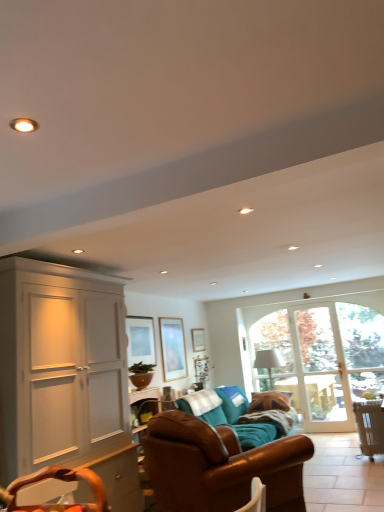
Identify the location of clear glass door at right. (362, 349).

Where is `brown leather swivel chair at lower left`? This screenshot has width=384, height=512. brown leather swivel chair at lower left is located at coordinates pyautogui.click(x=61, y=480).

Where is `white matte cabinet at left`? white matte cabinet at left is located at coordinates (65, 376).

Image resolution: width=384 pixels, height=512 pixels. Describe the element at coordinates (219, 466) in the screenshot. I see `brown leather couch at center, the 2th studio couch in the back-to-front sequence` at that location.

This screenshot has width=384, height=512. Find the location of `brown leather chair at lower right`. brown leather chair at lower right is located at coordinates (370, 426).

Locate an element on the screen. The height and width of the screenshot is (512, 384). clear glass door at right is located at coordinates (362, 349).

Is clear glass door at right closer to camera compared to matte wooden picture frame at center, the second picture frame from the left?

No, it is behind matte wooden picture frame at center, the second picture frame from the left.

Is clear glass door at right to the left of matte wooden picture frame at center, positioned as the second picture frame in right-to-left order, from the viewer's perspective?

No, clear glass door at right is not to the left of matte wooden picture frame at center, positioned as the second picture frame in right-to-left order.

Is clear glass door at right spatially inside matte wooden picture frame at center, which is the second picture frame in front-to-back order, or outside of it?

clear glass door at right cannot be found inside matte wooden picture frame at center, which is the second picture frame in front-to-back order.

Would you say clear glass door at right is a long distance from matte wooden picture frame at center, which is the second picture frame in front-to-back order?

Indeed, clear glass door at right is not near matte wooden picture frame at center, which is the second picture frame in front-to-back order.

The width and height of the screenshot is (384, 512). What are the coordinates of `houseplant that is on the left side of brown leather swivel chair at lower left` in the screenshot? It's located at (141, 374).

Does brown leather swivel chair at lower left touch green matte plant at center?

No, brown leather swivel chair at lower left is not making contact with green matte plant at center.

Is brown leather swivel chair at lower left located outside green matte plant at center?

Absolutely, brown leather swivel chair at lower left is external to green matte plant at center.

From a real-world perspective, between brown leather swivel chair at lower left and green matte plant at center, who is vertically higher?

green matte plant at center is physically above.

In terms of size, does clear glass door at right appear bigger or smaller than matte wooden picture frame at center, the second picture frame from the left?

In the image, clear glass door at right appears to be larger than matte wooden picture frame at center, the second picture frame from the left.

Can you confirm if clear glass door at right is positioned to the right of matte wooden picture frame at center, the second picture frame from the left?

Indeed, clear glass door at right is positioned on the right side of matte wooden picture frame at center, the second picture frame from the left.

Is point (382, 349) more distant than point (165, 377)?

Yes, it is behind point (165, 377).

Is clear glass door at right in contact with matte wooden picture frame at center, which is the second picture frame in front-to-back order?

No, clear glass door at right is not with matte wooden picture frame at center, which is the second picture frame in front-to-back order.

In the image, is brown leather couch at center, the 2th studio couch in the back-to-front sequence, on the left side or the right side of green matte plant at center?

brown leather couch at center, the 2th studio couch in the back-to-front sequence, is positioned on green matte plant at center's right side.

Could you tell me if brown leather couch at center, the first studio couch viewed from the front, is turned towards green matte plant at center?

No, brown leather couch at center, the first studio couch viewed from the front, is not oriented towards green matte plant at center.

Considering the sizes of objects brown leather couch at center, the 2th studio couch in the back-to-front sequence, and green matte plant at center in the image provided, who is smaller, brown leather couch at center, the 2th studio couch in the back-to-front sequence, or green matte plant at center?

With smaller size is green matte plant at center.

From the image's perspective, is matte wooden picture frame at center, the second picture frame from the left, located beneath brown leather couch at center, the 2th studio couch in the back-to-front sequence?

No.

Is matte wooden picture frame at center, which is counted as the second picture frame, starting from the back, taller than brown leather couch at center, the first studio couch viewed from the front?

No, matte wooden picture frame at center, which is counted as the second picture frame, starting from the back, is not taller than brown leather couch at center, the first studio couch viewed from the front.

Is matte wooden picture frame at center, positioned as the second picture frame in right-to-left order, looking in the opposite direction of brown leather couch at center, the first studio couch viewed from the front?

matte wooden picture frame at center, positioned as the second picture frame in right-to-left order, is not turned away from brown leather couch at center, the first studio couch viewed from the front.

From a real-world perspective, which is physically above, matte wooden picture frame at center, positioned as the second picture frame in right-to-left order, or brown leather couch at center, the first studio couch viewed from the front?

In real-world perspective, matte wooden picture frame at center, positioned as the second picture frame in right-to-left order, is above.

How many degrees apart are the facing directions of white matte cabinet at left and brown leather couch at center, the 2th studio couch in the back-to-front sequence?

The angle between the facing direction of white matte cabinet at left and the facing direction of brown leather couch at center, the 2th studio couch in the back-to-front sequence, is 58.4 degrees.

Considering the sizes of objects white matte cabinet at left and brown leather couch at center, the first studio couch viewed from the front, in the image provided, who is taller, white matte cabinet at left or brown leather couch at center, the first studio couch viewed from the front,?

With more height is white matte cabinet at left.

Is white matte cabinet at left wider or thinner than brown leather couch at center, the first studio couch viewed from the front?

Considering their sizes, white matte cabinet at left looks slimmer than brown leather couch at center, the first studio couch viewed from the front.

From the image's perspective, is white matte cabinet at left located above or below brown leather couch at center, the first studio couch viewed from the front?

white matte cabinet at left is above brown leather couch at center, the first studio couch viewed from the front.

From the image's perspective, between brown leather swivel chair at lower left and wooden picture frame at center, the first picture frame positioned from the right, which one is located above?

brown leather swivel chair at lower left.

Which point is more distant from viewer, (94, 476) or (197, 350)?

The point (197, 350) is behind.

Is brown leather swivel chair at lower left smaller than wooden picture frame at center, the first picture frame positioned from the right?

No.

Is brown leather swivel chair at lower left facing away from wooden picture frame at center, positioned as the 1th picture frame in back-to-front order?

No, wooden picture frame at center, positioned as the 1th picture frame in back-to-front order, is not at the back of brown leather swivel chair at lower left.

This screenshot has width=384, height=512. Find the location of `the 1st picture frame positioned above the clear glass door at right (from a real-world perspective)`. the 1st picture frame positioned above the clear glass door at right (from a real-world perspective) is located at coordinates (173, 348).

This screenshot has height=512, width=384. What are the coordinates of `swivel chair that appears below the green matte plant at center (from a real-world perspective)` in the screenshot? It's located at (61, 480).

In the scene shown: Considering their positions, is brown leather couch at center, the first studio couch viewed from the front, positioned closer to matte wooden picture frame at center, which is counted as the second picture frame, starting from the back, than brown leather swivel chair at lower left?

brown leather couch at center, the first studio couch viewed from the front.

Which object lies further to the anchor point green matte plant at center, clear glass door at right or brown leather chair at lower right?

clear glass door at right is positioned further to the anchor green matte plant at center.

Considering their positions, is matte glass picture frame at center, the 3th picture frame positioned from the right, positioned closer to brown leather couch at center, the first studio couch viewed from the front, than clear glass door at right?

matte glass picture frame at center, the 3th picture frame positioned from the right.

Considering their positions, is matte glass picture frame at center, the 1th picture frame in the front-to-back sequence, positioned closer to matte wooden picture frame at center, which is counted as the second picture frame, starting from the back, than brown leather couch at center, marked as the second studio couch in a front-to-back arrangement?

Among the two, matte glass picture frame at center, the 1th picture frame in the front-to-back sequence, is located nearer to matte wooden picture frame at center, which is counted as the second picture frame, starting from the back.

Based on their spatial positions, is brown leather couch at center, marked as the 1th studio couch in a back-to-front arrangement, or matte wooden picture frame at center, positioned as the second picture frame in right-to-left order, further from brown leather couch at center, the first studio couch viewed from the front?

matte wooden picture frame at center, positioned as the second picture frame in right-to-left order, lies further to brown leather couch at center, the first studio couch viewed from the front, than the other object.

Looking at the image, which one is located further to wooden picture frame at center, the 3th picture frame in the left-to-right sequence, matte glass picture frame at center, arranged as the third picture frame when viewed from the back, or brown leather couch at center, marked as the second studio couch in a front-to-back arrangement?

Based on the image, brown leather couch at center, marked as the second studio couch in a front-to-back arrangement, appears to be further to wooden picture frame at center, the 3th picture frame in the left-to-right sequence.

Considering their positions, is brown leather chair at lower right positioned further to green matte plant at center than brown leather couch at center, marked as the 1th studio couch in a back-to-front arrangement?

brown leather chair at lower right.

Looking at the image, which one is located closer to brown leather couch at center, marked as the 1th studio couch in a back-to-front arrangement, brown leather swivel chair at lower left or clear glass door at right?

Among the two, clear glass door at right is located nearer to brown leather couch at center, marked as the 1th studio couch in a back-to-front arrangement.

Find the location of a particular element. chair located between white matte cabinet at left and clear glass door at right in the depth direction is located at coordinates (370, 426).

The height and width of the screenshot is (512, 384). I want to click on picture frame situated between matte wooden picture frame at center, positioned as the second picture frame in right-to-left order, and clear glass door at right from left to right, so click(x=198, y=339).

This screenshot has height=512, width=384. In order to click on studio couch between brown leather couch at center, the 2th studio couch in the back-to-front sequence, and clear glass door at right, along the z-axis in this screenshot , I will do `click(238, 415)`.

This screenshot has height=512, width=384. I want to click on houseplant located between white matte cabinet at left and matte glass picture frame at center, marked as the first picture frame in a left-to-right arrangement, in the depth direction, so click(x=141, y=374).